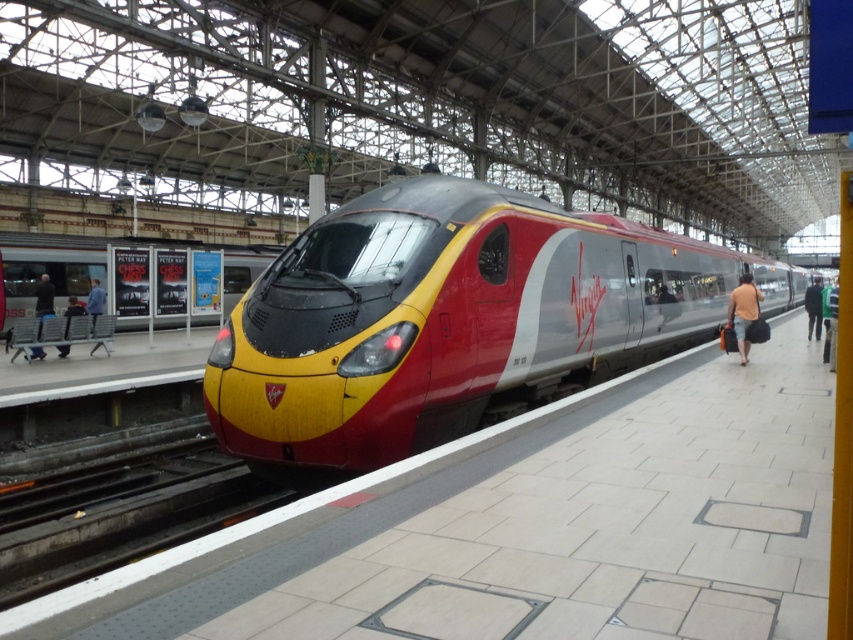
Between orange fabric bag at right and dark blue jacket at center, which one appears on the left side from the viewer's perspective?

orange fabric bag at right is more to the left.

Where is `orange fabric bag at right`? The image size is (853, 640). orange fabric bag at right is located at coordinates (743, 312).

Find the location of a particular element. This screenshot has height=640, width=853. orange fabric bag at right is located at coordinates (743, 312).

Between orange fabric bag at right and green fabric jacket at right, which one has more height?

Standing taller between the two is green fabric jacket at right.

Does orange fabric bag at right have a lesser width compared to green fabric jacket at right?

Indeed, orange fabric bag at right has a lesser width compared to green fabric jacket at right.

Between point (749, 291) and point (827, 304), which one is positioned in front?

Point (749, 291) is more forward.

Where is `orange fabric bag at right`? The height and width of the screenshot is (640, 853). orange fabric bag at right is located at coordinates (743, 312).

Does green fabric jacket at right come in front of dark blue jeans at left?

That is True.

Who is taller, green fabric jacket at right or dark blue jeans at left?

Standing taller between the two is green fabric jacket at right.

Which is behind, point (833, 316) or point (36, 355)?

Point (833, 316)

Locate an element on the screen. green fabric jacket at right is located at coordinates (828, 321).